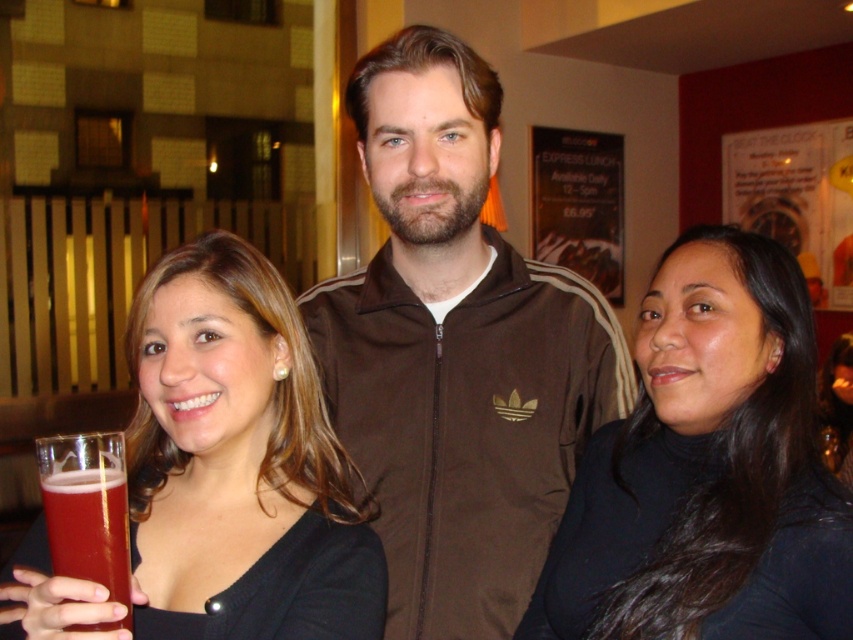
You are at a restaurant and see three people. The person on the left is holding a red drink. The person in the center is wearing a black matte turtleneck at center located at point (706, 470). Where exactly is the black matte turtleneck at center located?

The black matte turtleneck at center is located at point (706, 470).

You are a bartender at this venue and need to place the translucent glass beer at lower left and the matte black hair at center on a shelf. The shelf has a height limit of 10 inches. Can both items fit vertically on the shelf without exceeding the height limit?

The translucent glass beer at lower left has a lesser height compared to matte black hair at center. However, since the height of the matte black hair at center is not specified, we cannot confirm if it exceeds the 10 inch limit. Therefore, it is uncertain if both items will fit vertically on the shelf.